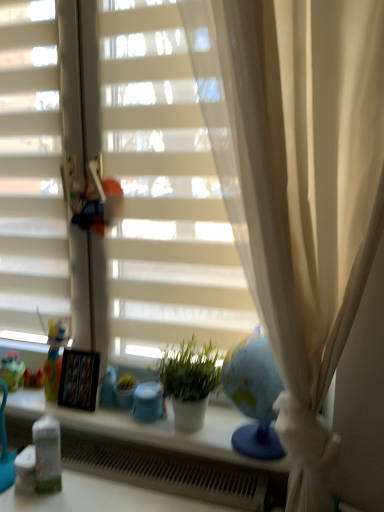
Question: Is the depth of matte plastic doll at left greater than that of white matte blinds at center?

Choices:
 (A) yes
 (B) no

Answer: (A)

Question: From the image's perspective, is matte plastic doll at left below white matte blinds at center?

Choices:
 (A) yes
 (B) no

Answer: (A)

Question: Can you confirm if matte plastic doll at left is bigger than white matte blinds at center?

Choices:
 (A) no
 (B) yes

Answer: (A)

Question: Is matte plastic doll at left turned away from white matte blinds at center?

Choices:
 (A) yes
 (B) no

Answer: (B)

Question: From a real-world perspective, is matte plastic doll at left on top of white matte blinds at center?

Choices:
 (A) no
 (B) yes

Answer: (A)

Question: Considering their positions, is white matte blinds at center located in front of or behind matte plastic doll at left?

Choices:
 (A) behind
 (B) front

Answer: (B)

Question: Is white matte blinds at center taller or shorter than matte plastic doll at left?

Choices:
 (A) tall
 (B) short

Answer: (A)

Question: Is white matte blinds at center situated inside matte plastic doll at left or outside?

Choices:
 (A) outside
 (B) inside

Answer: (A)

Question: In terms of width, does white matte blinds at center look wider or thinner when compared to matte plastic doll at left?

Choices:
 (A) thin
 (B) wide

Answer: (A)

Question: Looking at the image, does matte green toy at left seem bigger or smaller compared to white plastic radiator at lower center?

Choices:
 (A) big
 (B) small

Answer: (B)

Question: Relative to white plastic radiator at lower center, is matte green toy at left in front or behind?

Choices:
 (A) behind
 (B) front

Answer: (A)

Question: Would you say matte green toy at left is to the left or to the right of white plastic radiator at lower center in the picture?

Choices:
 (A) right
 (B) left

Answer: (B)

Question: Is matte green toy at left wider or thinner than white plastic radiator at lower center?

Choices:
 (A) thin
 (B) wide

Answer: (A)

Question: From the image's perspective, is matte green toy at left positioned above or below white matte plant pot at center?

Choices:
 (A) below
 (B) above

Answer: (A)

Question: Looking at the image, does matte green toy at left seem bigger or smaller compared to white matte plant pot at center?

Choices:
 (A) big
 (B) small

Answer: (B)